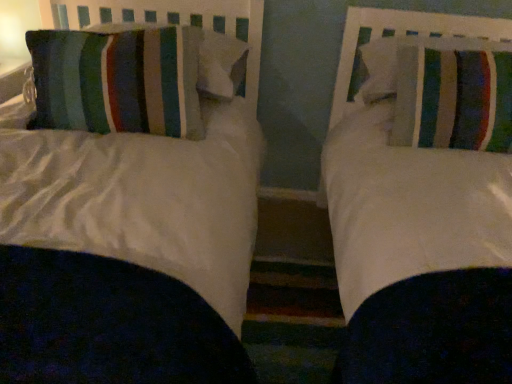
Measure the distance between point (378, 76) and camera.

Point (378, 76) and camera are 5.38 feet apart from each other.

Image resolution: width=512 pixels, height=384 pixels. What do you see at coordinates (454, 95) in the screenshot?
I see `striped fabric pillow at right, the 3th pillow viewed from the left` at bounding box center [454, 95].

Find the location of a particular element. Image resolution: width=512 pixels, height=384 pixels. striped fabric pillow at right, the 3th pillow viewed from the left is located at coordinates (454, 95).

Find the location of a particular element. The height and width of the screenshot is (384, 512). striped fabric pillow at right, marked as the 4th pillow in a left-to-right arrangement is located at coordinates (398, 60).

Can you tell me how much striped fabric pillow at left, acting as the 3th pillow starting from the right, and striped fabric pillow at left, the fourth pillow when ordered from right to left, differ in facing direction?

The angular difference between striped fabric pillow at left, acting as the 3th pillow starting from the right, and striped fabric pillow at left, the fourth pillow when ordered from right to left, is 91.3 degrees.

Is striped fabric pillow at left, the second pillow when ordered from left to right, bigger or smaller than striped fabric pillow at left, acting as the 1th pillow starting from the left?

Considering their sizes, striped fabric pillow at left, the second pillow when ordered from left to right, takes up less space than striped fabric pillow at left, acting as the 1th pillow starting from the left.

Is striped fabric pillow at left, the second pillow when ordered from left to right, in front of or behind striped fabric pillow at left, acting as the 1th pillow starting from the left, in the image?

striped fabric pillow at left, the second pillow when ordered from left to right, is behind striped fabric pillow at left, acting as the 1th pillow starting from the left.

Is point (505, 47) positioned after point (461, 80)?

Yes, point (505, 47) is behind point (461, 80).

At what (x,y) coordinates should I click in order to perform the action: click on the 2nd pillow above the striped fabric pillow at right, the second pillow when ordered from right to left (from the image's perspective). Please return your answer as a coordinate pair (x, y). This screenshot has width=512, height=384. Looking at the image, I should click on (398, 60).

Considering the sizes of striped fabric pillow at right, which appears as the first pillow when viewed from the right, and striped fabric pillow at right, the 3th pillow viewed from the left, in the image, is striped fabric pillow at right, which appears as the first pillow when viewed from the right, wider or thinner than striped fabric pillow at right, the 3th pillow viewed from the left,?

striped fabric pillow at right, which appears as the first pillow when viewed from the right, is wider than striped fabric pillow at right, the 3th pillow viewed from the left.

Is striped fabric pillow at right, which appears as the first pillow when viewed from the right, to the right of striped fabric pillow at right, the second pillow when ordered from right to left, from the viewer's perspective?

Yes, striped fabric pillow at right, which appears as the first pillow when viewed from the right, is to the right of striped fabric pillow at right, the second pillow when ordered from right to left.

Is striped fabric pillow at left, acting as the 3th pillow starting from the right, facing towards striped fabric pillow at right, the 3th pillow viewed from the left?

No, striped fabric pillow at left, acting as the 3th pillow starting from the right, is not facing towards striped fabric pillow at right, the 3th pillow viewed from the left.

From the image's perspective, which one is positioned lower, striped fabric pillow at left, acting as the 3th pillow starting from the right, or striped fabric pillow at right, the 3th pillow viewed from the left?

From the image's view, striped fabric pillow at right, the 3th pillow viewed from the left, is below.

Is striped fabric pillow at left, the fourth pillow when ordered from right to left, oriented towards striped fabric pillow at left, the second pillow when ordered from left to right?

Yes.

Consider the image. Considering the positions of objects striped fabric pillow at left, the fourth pillow when ordered from right to left, and striped fabric pillow at left, acting as the 3th pillow starting from the right, in the image provided, who is in front, striped fabric pillow at left, the fourth pillow when ordered from right to left, or striped fabric pillow at left, acting as the 3th pillow starting from the right,?

striped fabric pillow at left, the fourth pillow when ordered from right to left, is closer to the camera.

Is the surface of striped fabric pillow at left, the fourth pillow when ordered from right to left, in direct contact with striped fabric pillow at left, acting as the 3th pillow starting from the right?

No, striped fabric pillow at left, the fourth pillow when ordered from right to left, is not with striped fabric pillow at left, acting as the 3th pillow starting from the right.

From the image's perspective, between striped fabric pillow at right, marked as the 4th pillow in a left-to-right arrangement, and striped fabric pillow at left, acting as the 3th pillow starting from the right, who is located below?

striped fabric pillow at right, marked as the 4th pillow in a left-to-right arrangement, from the image's perspective.

Who is bigger, striped fabric pillow at right, marked as the 4th pillow in a left-to-right arrangement, or striped fabric pillow at left, the second pillow when ordered from left to right?

Bigger between the two is striped fabric pillow at left, the second pillow when ordered from left to right.

Are striped fabric pillow at right, marked as the 4th pillow in a left-to-right arrangement, and striped fabric pillow at left, acting as the 3th pillow starting from the right, located far from each other?

No, there isn't a large distance between striped fabric pillow at right, marked as the 4th pillow in a left-to-right arrangement, and striped fabric pillow at left, acting as the 3th pillow starting from the right.

Looking at this image, is striped fabric pillow at right, marked as the 4th pillow in a left-to-right arrangement, shorter than striped fabric pillow at left, acting as the 3th pillow starting from the right?

Yes, striped fabric pillow at right, marked as the 4th pillow in a left-to-right arrangement, is shorter than striped fabric pillow at left, acting as the 3th pillow starting from the right.

Based on their sizes in the image, would you say striped fabric pillow at right, the second pillow when ordered from right to left, is bigger or smaller than striped fabric pillow at right, marked as the 4th pillow in a left-to-right arrangement?

In the image, striped fabric pillow at right, the second pillow when ordered from right to left, appears to be larger than striped fabric pillow at right, marked as the 4th pillow in a left-to-right arrangement.

From the image's perspective, does striped fabric pillow at right, the 3th pillow viewed from the left, appear lower than striped fabric pillow at right, which appears as the first pillow when viewed from the right?

Yes, from the image's perspective, striped fabric pillow at right, the 3th pillow viewed from the left, is below striped fabric pillow at right, which appears as the first pillow when viewed from the right.

Choose the correct answer: Is striped fabric pillow at right, the second pillow when ordered from right to left, inside striped fabric pillow at right, marked as the 4th pillow in a left-to-right arrangement, or outside it?

striped fabric pillow at right, the second pillow when ordered from right to left, lies outside striped fabric pillow at right, marked as the 4th pillow in a left-to-right arrangement.

Is point (507, 152) in front of point (455, 41)?

Yes, it is in front of point (455, 41).

Who is smaller, striped fabric pillow at right, the 3th pillow viewed from the left, or striped fabric pillow at left, the fourth pillow when ordered from right to left?

With smaller size is striped fabric pillow at right, the 3th pillow viewed from the left.

Could you measure the distance between striped fabric pillow at right, the 3th pillow viewed from the left, and striped fabric pillow at left, acting as the 1th pillow starting from the left?

They are 89.86 centimeters apart.

Would you say striped fabric pillow at right, the second pillow when ordered from right to left, is to the left or to the right of striped fabric pillow at left, acting as the 1th pillow starting from the left, in the picture?

Based on their positions, striped fabric pillow at right, the second pillow when ordered from right to left, is located to the right of striped fabric pillow at left, acting as the 1th pillow starting from the left.

Is striped fabric pillow at right, the second pillow when ordered from right to left, inside or outside of striped fabric pillow at left, the fourth pillow when ordered from right to left?

striped fabric pillow at right, the second pillow when ordered from right to left, is not inside striped fabric pillow at left, the fourth pillow when ordered from right to left, it's outside.

Find the location of a particular element. The height and width of the screenshot is (384, 512). pillow that is the 3rd object located behind the striped fabric pillow at left, the fourth pillow when ordered from right to left is located at coordinates (221, 64).

This screenshot has width=512, height=384. There is a striped fabric pillow at right, which appears as the first pillow when viewed from the right. What are the coordinates of `the 2nd pillow below it (from the image's perspective)` in the screenshot? It's located at (454, 95).

Consider the image. Which object lies nearer to the anchor point striped fabric pillow at right, the second pillow when ordered from right to left, striped fabric pillow at left, the fourth pillow when ordered from right to left, or striped fabric pillow at right, which appears as the first pillow when viewed from the right?

striped fabric pillow at right, which appears as the first pillow when viewed from the right, is positioned closer to the anchor striped fabric pillow at right, the second pillow when ordered from right to left.

From the image, which object appears to be nearer to striped fabric pillow at left, the second pillow when ordered from left to right, striped fabric pillow at left, acting as the 1th pillow starting from the left, or striped fabric pillow at right, which appears as the first pillow when viewed from the right?

striped fabric pillow at left, acting as the 1th pillow starting from the left, is positioned closer to the anchor striped fabric pillow at left, the second pillow when ordered from left to right.

Considering their positions, is striped fabric pillow at left, the fourth pillow when ordered from right to left, positioned closer to striped fabric pillow at right, marked as the 4th pillow in a left-to-right arrangement, than striped fabric pillow at left, acting as the 3th pillow starting from the right?

striped fabric pillow at left, acting as the 3th pillow starting from the right, is positioned closer to the anchor striped fabric pillow at right, marked as the 4th pillow in a left-to-right arrangement.

From the image, which object appears to be farther from striped fabric pillow at right, the 3th pillow viewed from the left, striped fabric pillow at left, acting as the 1th pillow starting from the left, or striped fabric pillow at left, the second pillow when ordered from left to right?

striped fabric pillow at left, acting as the 1th pillow starting from the left, is further to striped fabric pillow at right, the 3th pillow viewed from the left.

Estimate the real-world distances between objects in this image. Which object is further from striped fabric pillow at left, acting as the 1th pillow starting from the left, striped fabric pillow at right, marked as the 4th pillow in a left-to-right arrangement, or striped fabric pillow at left, acting as the 3th pillow starting from the right?

striped fabric pillow at right, marked as the 4th pillow in a left-to-right arrangement, is further to striped fabric pillow at left, acting as the 1th pillow starting from the left.

From the image, which object appears to be nearer to striped fabric pillow at left, acting as the 1th pillow starting from the left, striped fabric pillow at right, the second pillow when ordered from right to left, or striped fabric pillow at right, marked as the 4th pillow in a left-to-right arrangement?

striped fabric pillow at right, marked as the 4th pillow in a left-to-right arrangement.

Considering their positions, is striped fabric pillow at right, which appears as the first pillow when viewed from the right, positioned closer to striped fabric pillow at left, the second pillow when ordered from left to right, than striped fabric pillow at right, the second pillow when ordered from right to left?

The object closer to striped fabric pillow at left, the second pillow when ordered from left to right, is striped fabric pillow at right, which appears as the first pillow when viewed from the right.

From the image, which object appears to be nearer to striped fabric pillow at left, the fourth pillow when ordered from right to left, striped fabric pillow at left, acting as the 3th pillow starting from the right, or striped fabric pillow at right, the 3th pillow viewed from the left?

The object closer to striped fabric pillow at left, the fourth pillow when ordered from right to left, is striped fabric pillow at left, acting as the 3th pillow starting from the right.

Identify the location of pillow located between striped fabric pillow at left, the second pillow when ordered from left to right, and striped fabric pillow at right, which appears as the first pillow when viewed from the right, in the left-right direction. The image size is (512, 384). (454, 95).

Where is `pillow situated between striped fabric pillow at left, the fourth pillow when ordered from right to left, and striped fabric pillow at right, the second pillow when ordered from right to left, from left to right`? This screenshot has width=512, height=384. pillow situated between striped fabric pillow at left, the fourth pillow when ordered from right to left, and striped fabric pillow at right, the second pillow when ordered from right to left, from left to right is located at coordinates (221, 64).